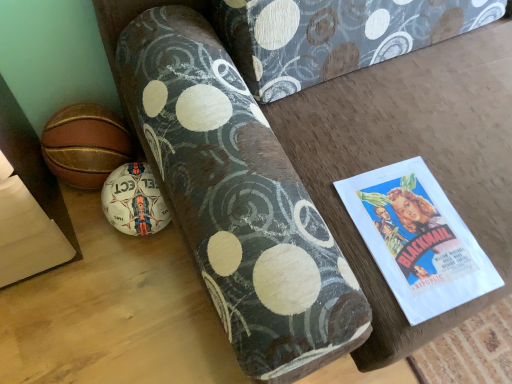
Locate an element on the screen. The image size is (512, 384). white matte soccer ball at lower left, the second ball in the top-to-bottom sequence is located at coordinates (134, 200).

What do you see at coordinates (134, 200) in the screenshot? I see `white matte soccer ball at lower left, marked as the first ball in a bottom-to-top arrangement` at bounding box center [134, 200].

Describe the element at coordinates (85, 144) in the screenshot. The image size is (512, 384). I see `leather basketball at lower left, arranged as the second ball when ordered from the bottom` at that location.

Find the location of a particular element. leather basketball at lower left, arranged as the second ball when ordered from the bottom is located at coordinates tap(85, 144).

In the scene shown: In order to face leather basketball at lower left, placed as the first ball when sorted from top to bottom, should I rotate leftwards or rightwards?

Rotate your view left by about 20.103°.

Find the location of a particular element. The width and height of the screenshot is (512, 384). white matte soccer ball at lower left, the second ball in the top-to-bottom sequence is located at coordinates (134, 200).

Which object is positioned more to the right, white matte soccer ball at lower left, the second ball in the top-to-bottom sequence, or leather basketball at lower left, arranged as the second ball when ordered from the bottom?

white matte soccer ball at lower left, the second ball in the top-to-bottom sequence, is more to the right.

Between white matte soccer ball at lower left, the second ball in the top-to-bottom sequence, and leather basketball at lower left, arranged as the second ball when ordered from the bottom, which one is positioned behind?

leather basketball at lower left, arranged as the second ball when ordered from the bottom, is further away from the camera.

Considering the points (136, 182) and (119, 160), which point is in front, point (136, 182) or point (119, 160)?

The point (136, 182) is in front.

From the image's perspective, is white matte soccer ball at lower left, the second ball in the top-to-bottom sequence, located above leather basketball at lower left, placed as the first ball when sorted from top to bottom?

No, from the image's perspective, white matte soccer ball at lower left, the second ball in the top-to-bottom sequence, is not over leather basketball at lower left, placed as the first ball when sorted from top to bottom.

From a real-world perspective, which is physically below, white matte soccer ball at lower left, the second ball in the top-to-bottom sequence, or leather basketball at lower left, arranged as the second ball when ordered from the bottom?

From a 3D spatial view, white matte soccer ball at lower left, the second ball in the top-to-bottom sequence, is below.

Is white matte soccer ball at lower left, the second ball in the top-to-bottom sequence, wider than leather basketball at lower left, arranged as the second ball when ordered from the bottom?

Yes, white matte soccer ball at lower left, the second ball in the top-to-bottom sequence, is wider than leather basketball at lower left, arranged as the second ball when ordered from the bottom.

Between white matte soccer ball at lower left, the second ball in the top-to-bottom sequence, and leather basketball at lower left, arranged as the second ball when ordered from the bottom, which one has more height?

Standing taller between the two is white matte soccer ball at lower left, the second ball in the top-to-bottom sequence.

Who is bigger, white matte soccer ball at lower left, the second ball in the top-to-bottom sequence, or leather basketball at lower left, arranged as the second ball when ordered from the bottom?

leather basketball at lower left, arranged as the second ball when ordered from the bottom.

Is leather basketball at lower left, arranged as the second ball when ordered from the bottom, a part of white matte soccer ball at lower left, marked as the first ball in a bottom-to-top arrangement?

No, leather basketball at lower left, arranged as the second ball when ordered from the bottom, is not surrounded by white matte soccer ball at lower left, marked as the first ball in a bottom-to-top arrangement.

Are white matte soccer ball at lower left, the second ball in the top-to-bottom sequence, and leather basketball at lower left, arranged as the second ball when ordered from the bottom, beside each other?

white matte soccer ball at lower left, the second ball in the top-to-bottom sequence, and leather basketball at lower left, arranged as the second ball when ordered from the bottom, are clearly separated.

Could you tell me if white matte soccer ball at lower left, marked as the first ball in a bottom-to-top arrangement, is facing leather basketball at lower left, placed as the first ball when sorted from top to bottom?

No, white matte soccer ball at lower left, marked as the first ball in a bottom-to-top arrangement, is not facing towards leather basketball at lower left, placed as the first ball when sorted from top to bottom.

How many degrees apart are the facing directions of white matte soccer ball at lower left, the second ball in the top-to-bottom sequence, and leather basketball at lower left, arranged as the second ball when ordered from the bottom?

8.92e-05 degrees separate the facing orientations of white matte soccer ball at lower left, the second ball in the top-to-bottom sequence, and leather basketball at lower left, arranged as the second ball when ordered from the bottom.

The image size is (512, 384). Find the location of `ball on the right of leather basketball at lower left, arranged as the second ball when ordered from the bottom`. ball on the right of leather basketball at lower left, arranged as the second ball when ordered from the bottom is located at coordinates (134, 200).

Does leather basketball at lower left, placed as the first ball when sorted from top to bottom, appear on the right side of white matte soccer ball at lower left, the second ball in the top-to-bottom sequence?

Incorrect, leather basketball at lower left, placed as the first ball when sorted from top to bottom, is not on the right side of white matte soccer ball at lower left, the second ball in the top-to-bottom sequence.

Relative to white matte soccer ball at lower left, marked as the first ball in a bottom-to-top arrangement, is leather basketball at lower left, arranged as the second ball when ordered from the bottom, in front or behind?

Clearly, leather basketball at lower left, arranged as the second ball when ordered from the bottom, is behind white matte soccer ball at lower left, marked as the first ball in a bottom-to-top arrangement.

Does point (103, 116) come closer to viewer compared to point (127, 167)?

That is False.

From the image's perspective, does leather basketball at lower left, placed as the first ball when sorted from top to bottom, appear higher than white matte soccer ball at lower left, the second ball in the top-to-bottom sequence?

Yes.

From a real-world perspective, relative to white matte soccer ball at lower left, the second ball in the top-to-bottom sequence, is leather basketball at lower left, arranged as the second ball when ordered from the bottom, vertically above or below?

From a real-world perspective, leather basketball at lower left, arranged as the second ball when ordered from the bottom, is physically above white matte soccer ball at lower left, the second ball in the top-to-bottom sequence.

Which object is thinner, leather basketball at lower left, arranged as the second ball when ordered from the bottom, or white matte soccer ball at lower left, the second ball in the top-to-bottom sequence?

With smaller width is leather basketball at lower left, arranged as the second ball when ordered from the bottom.

From their relative heights in the image, would you say leather basketball at lower left, placed as the first ball when sorted from top to bottom, is taller or shorter than white matte soccer ball at lower left, marked as the first ball in a bottom-to-top arrangement?

leather basketball at lower left, placed as the first ball when sorted from top to bottom, is shorter than white matte soccer ball at lower left, marked as the first ball in a bottom-to-top arrangement.

Does leather basketball at lower left, placed as the first ball when sorted from top to bottom, have a smaller size compared to white matte soccer ball at lower left, marked as the first ball in a bottom-to-top arrangement?

Incorrect, leather basketball at lower left, placed as the first ball when sorted from top to bottom, is not smaller in size than white matte soccer ball at lower left, marked as the first ball in a bottom-to-top arrangement.

Based on the photo, is white matte soccer ball at lower left, marked as the first ball in a bottom-to-top arrangement, a part of leather basketball at lower left, arranged as the second ball when ordered from the bottom?

No.

Are leather basketball at lower left, placed as the first ball when sorted from top to bottom, and white matte soccer ball at lower left, marked as the first ball in a bottom-to-top arrangement, located far from each other?

No, leather basketball at lower left, placed as the first ball when sorted from top to bottom, is not far from white matte soccer ball at lower left, marked as the first ball in a bottom-to-top arrangement.

Is leather basketball at lower left, placed as the first ball when sorted from top to bottom, facing away from white matte soccer ball at lower left, marked as the first ball in a bottom-to-top arrangement?

leather basketball at lower left, placed as the first ball when sorted from top to bottom, is not turned away from white matte soccer ball at lower left, marked as the first ball in a bottom-to-top arrangement.

The image size is (512, 384). Find the location of `ball that is behind the white matte soccer ball at lower left, the second ball in the top-to-bottom sequence`. ball that is behind the white matte soccer ball at lower left, the second ball in the top-to-bottom sequence is located at coordinates (85, 144).

Locate an element on the screen. Image resolution: width=512 pixels, height=384 pixels. ball above the white matte soccer ball at lower left, marked as the first ball in a bottom-to-top arrangement (from a real-world perspective) is located at coordinates coord(85,144).

In the image, there is a leather basketball at lower left, arranged as the second ball when ordered from the bottom. Where is `ball below it (from a real-world perspective)`? ball below it (from a real-world perspective) is located at coordinates (134, 200).